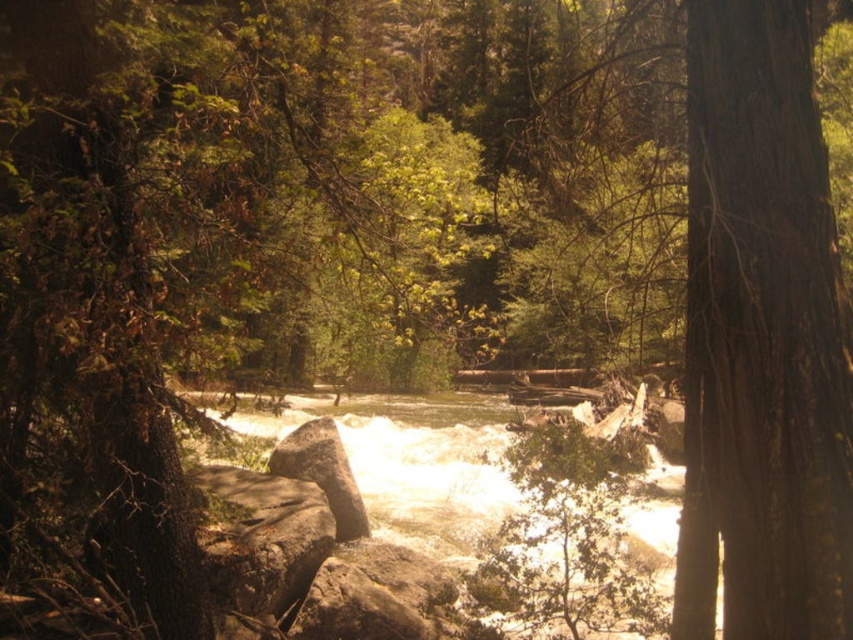
Question: Which of the following is the farthest from the observer?

Choices:
 (A) rough textured rock at center
 (B) brown rough rock at center
 (C) gray rough boulder at center

Answer: (C)

Question: Observing the image, what is the correct spatial positioning of brown rough rock at center in reference to gray rough boulder at center?

Choices:
 (A) right
 (B) left

Answer: (B)

Question: Is smooth brown tree trunk at right below gray rough boulder at center?

Choices:
 (A) yes
 (B) no

Answer: (B)

Question: Is white frothy water at center smaller than gray rough boulder at center?

Choices:
 (A) yes
 (B) no

Answer: (B)

Question: Which of these objects is positioned closest to the brown rough rock at center?

Choices:
 (A) rough textured rock at center
 (B) gray rough boulder at center
 (C) smooth brown tree trunk at right

Answer: (A)

Question: Which of these objects is positioned closest to the gray rough boulder at center?

Choices:
 (A) white frothy water at center
 (B) smooth brown tree trunk at right
 (C) rough textured rock at center

Answer: (C)